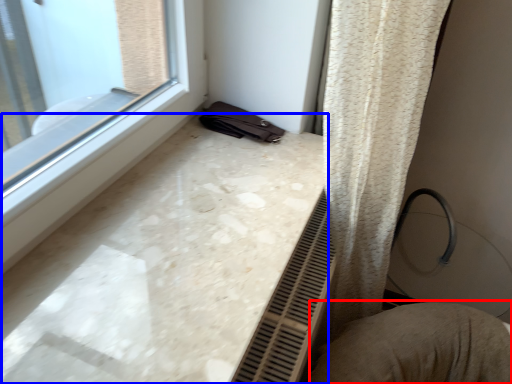
Question: Which of the following is the closest to the observer, swivel chair (highlighted by a red box) or counter top (highlighted by a blue box)?

Choices:
 (A) swivel chair
 (B) counter top

Answer: (B)